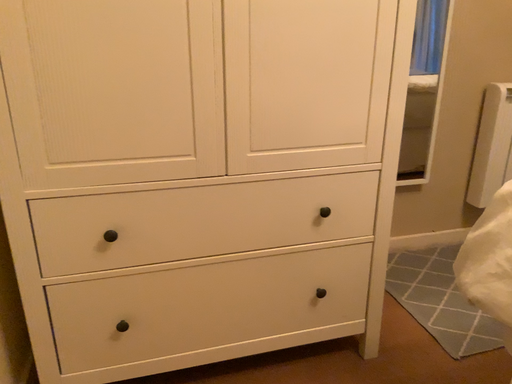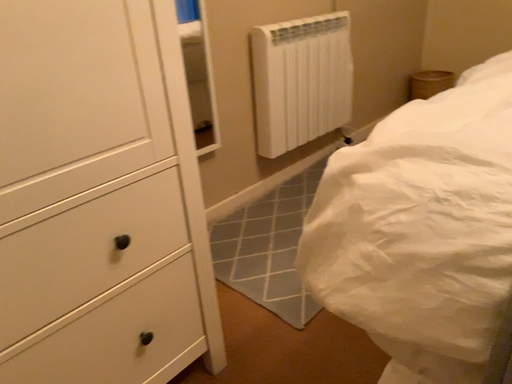
Question: How did the camera likely rotate when shooting the video?

Choices:
 (A) rotated right
 (B) rotated left

Answer: (A)